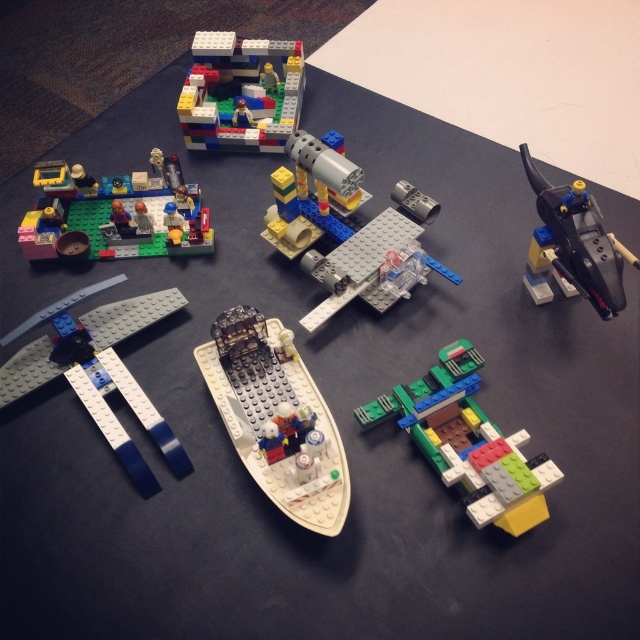
You are a LEGO enthusiast who wants to place a new LEGO set between the white plastic boat at center and the LEGO house in the upper left corner. The new set requires a minimum of 3 feet of space. Do you have enough space between them?

The distance between the white plastic boat at center and the LEGO house in upper left corner is 3.63 feet, which is more than the required 3 feet. Therefore, there is enough space to place the new LEGO set between them.

You are organizing a LEGO display and want to place the white plastic boat at center next to the brick red plastic building at upper center. Given their sizes, which object should be placed first to ensure they fit properly on the dark blue surface?

The white plastic boat at center has a smaller width than the brick red plastic building at upper center, so you should place the brick red plastic building at upper center first to accommodate its larger size before positioning the boat.

In the scene shown: You are a LEGO enthusiast looking at the scene. You notice the white plastic boat at center and the brick red plastic building at upper center. Which object is closer to you from your viewing position?

The white plastic boat at center is closer to you because it is in front of the brick red plastic building at upper center.